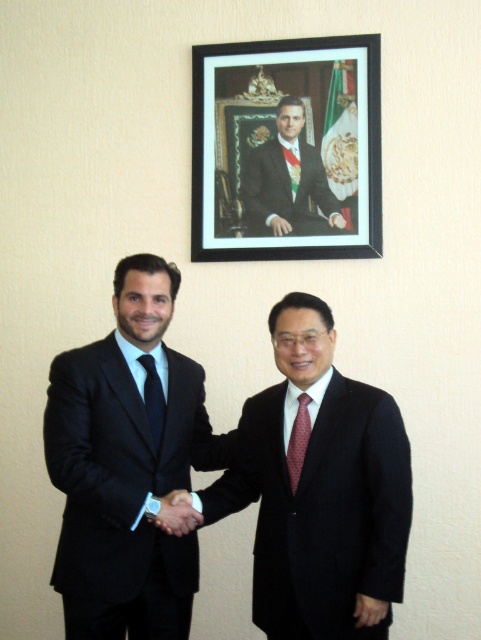
Question: Which object appears farthest from the camera in this image?

Choices:
 (A) matte black suit at center
 (B) black matte picture frame at upper center

Answer: (B)

Question: Which point is farther from the camera taking this photo?

Choices:
 (A) (289, 156)
 (B) (85, 548)

Answer: (A)

Question: Is matte black suit at center below matte black suit at upper center?

Choices:
 (A) no
 (B) yes

Answer: (B)

Question: Does black matte picture frame at upper center appear on the right side of smooth leather hand at center?

Choices:
 (A) yes
 (B) no

Answer: (A)

Question: Which object is the closest to the polka dot silk tie at center?

Choices:
 (A) smooth leather hand at center
 (B) red silk tie at center
 (C) black silk tie at center
 (D) matte black suit at left

Answer: (A)

Question: Does matte black suit at left have a smaller size compared to matte black suit at center?

Choices:
 (A) no
 (B) yes

Answer: (A)